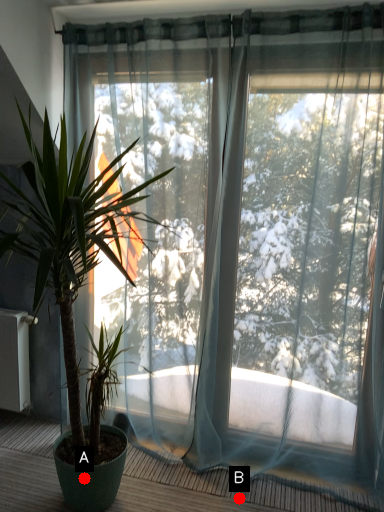
Question: Two points are circled on the image, labeled by A and B beside each circle. Which point is further to the camera?

Choices:
 (A) A is further
 (B) B is further

Answer: (B)